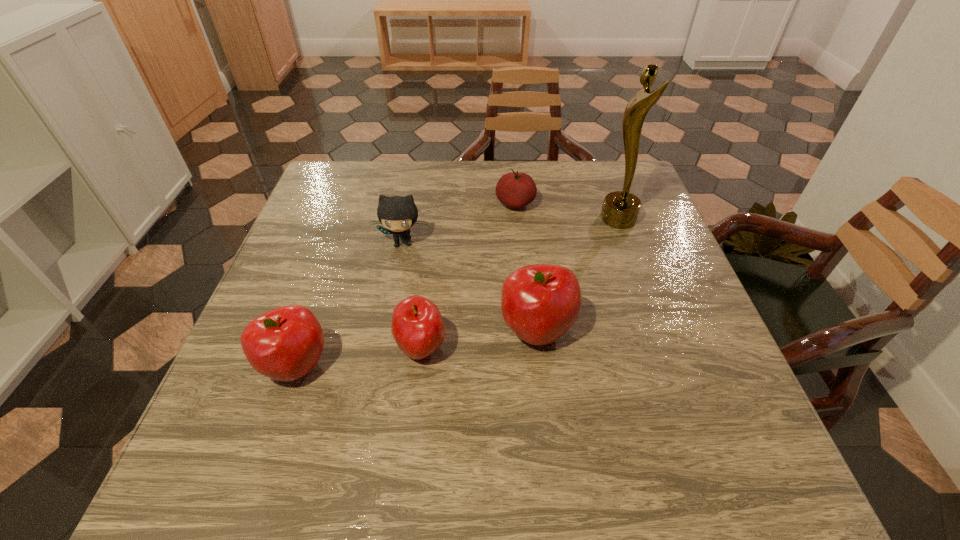
Find the location of a particular element. free space located on the left of the rightmost apple is located at coordinates (388, 330).

Find the location of `vacant space situated 0.390m on the front-facing side of the award`. vacant space situated 0.390m on the front-facing side of the award is located at coordinates (454, 219).

Locate an element on the screen. The height and width of the screenshot is (540, 960). free region located 0.140m on the front-facing side of the award is located at coordinates (548, 219).

Locate an element on the screen. vacant space located on the front-facing side of the award is located at coordinates (503, 219).

Find the location of `vacant space located on the left of the shortest object`. vacant space located on the left of the shortest object is located at coordinates (379, 204).

This screenshot has width=960, height=540. What are the coordinates of `vacant space located 0.400m on the front-facing side of the kitten` in the screenshot? It's located at (372, 401).

The height and width of the screenshot is (540, 960). Identify the location of award that is at the far edge. (620, 209).

Where is `tomato situated at the far edge`? tomato situated at the far edge is located at coordinates (515, 189).

The height and width of the screenshot is (540, 960). I want to click on object present at the near edge, so point(285,344).

The width and height of the screenshot is (960, 540). What are the coordinates of `object that is at the left edge` in the screenshot? It's located at 285,344.